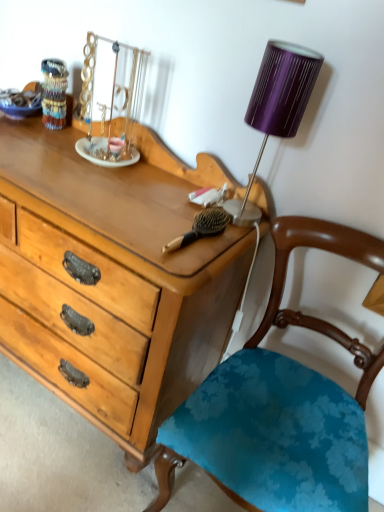
Question: Looking at their shapes, would you say purple ribbed fabric lampshade at upper right is wider or thinner than brown wooden brush at center?

Choices:
 (A) thin
 (B) wide

Answer: (A)

Question: From a real-world perspective, is purple ribbed fabric lampshade at upper right above or below brown wooden brush at center?

Choices:
 (A) below
 (B) above

Answer: (B)

Question: Which is nearer to the blue floral fabric chair at center?

Choices:
 (A) purple ribbed fabric lampshade at upper right
 (B) multicolored glass beads at upper left
 (C) brown wooden brush at center

Answer: (C)

Question: Which object is positioned closest to the blue floral fabric chair at center?

Choices:
 (A) purple ribbed fabric lampshade at upper right
 (B) multicolored glass beads at upper left
 (C) brown wooden brush at center

Answer: (C)